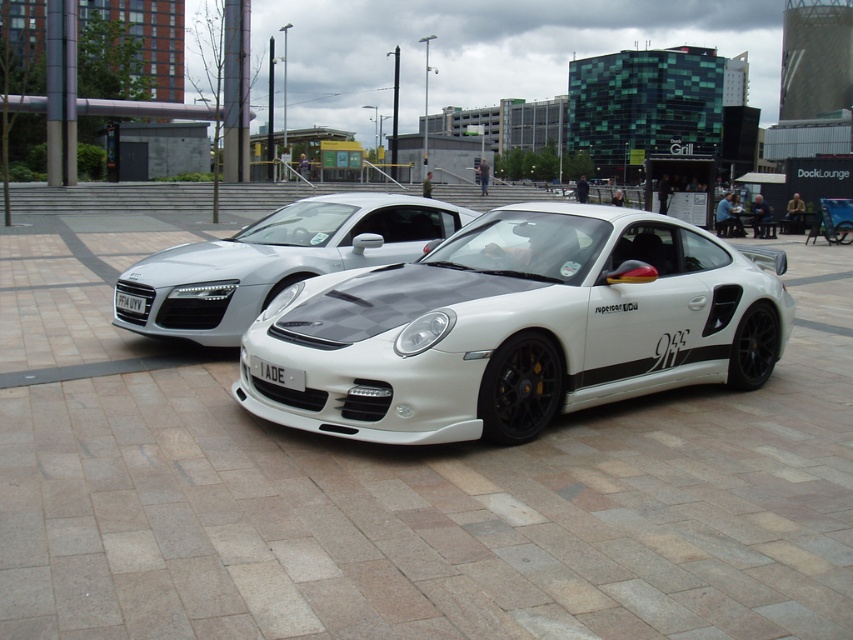
Who is shorter, white matte sports car at center or white plastic license plate at center?

With less height is white plastic license plate at center.

Is white matte sports car at center further to the viewer compared to white plastic license plate at center?

No.

The height and width of the screenshot is (640, 853). Find the location of `white matte sports car at center`. white matte sports car at center is located at coordinates (514, 326).

Find the location of a particular element. The height and width of the screenshot is (640, 853). white matte sports car at center is located at coordinates (514, 326).

Is white matte porsche 911 at center below white plastic license plate at center?

Correct, white matte porsche 911 at center is located below white plastic license plate at center.

This screenshot has height=640, width=853. I want to click on white matte porsche 911 at center, so click(x=277, y=260).

Who is more distant from viewer, (184,253) or (134,301)?

The point (184,253) is behind.

Where is `white matte porsche 911 at center`? The width and height of the screenshot is (853, 640). white matte porsche 911 at center is located at coordinates pos(277,260).

Can you confirm if white matte sports car at center is taller than white matte porsche 911 at center?

Correct, white matte sports car at center is much taller as white matte porsche 911 at center.

Is white matte sports car at center bigger than white matte porsche 911 at center?

Indeed, white matte sports car at center has a larger size compared to white matte porsche 911 at center.

Is point (614, 365) positioned after point (241, 268)?

No.

The image size is (853, 640). I want to click on white matte sports car at center, so (514, 326).